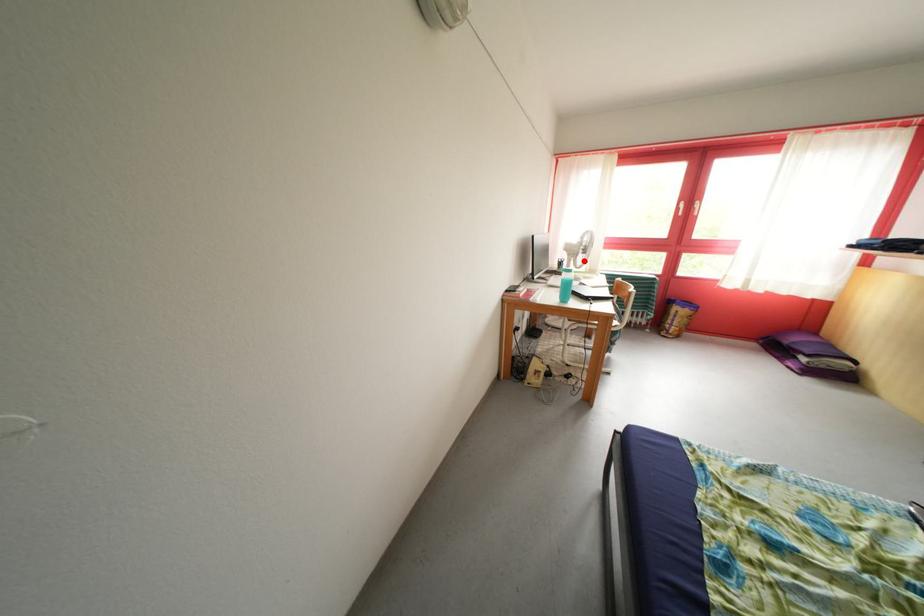
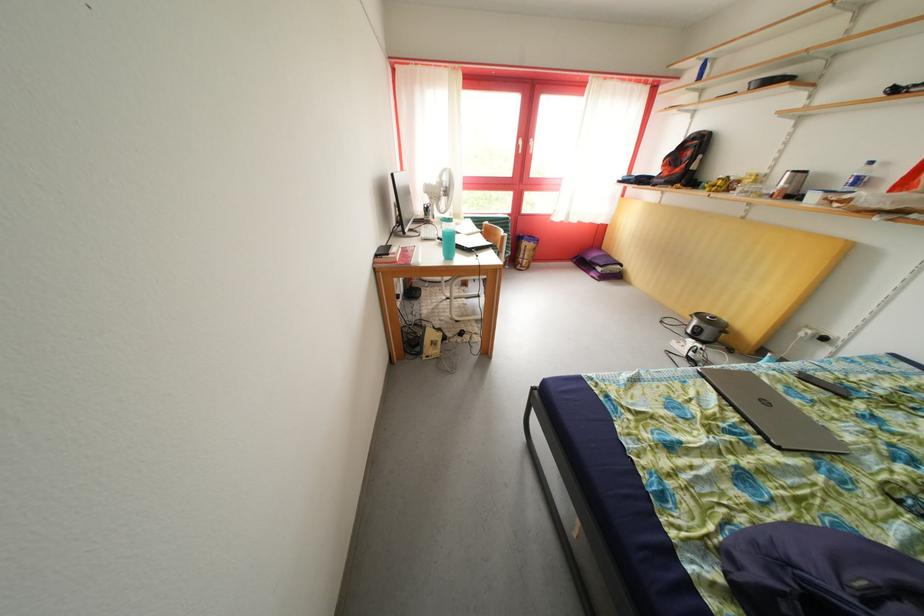
Locate, in the second image, the point that corresponds to the highlighted location in the first image.

(446, 204)